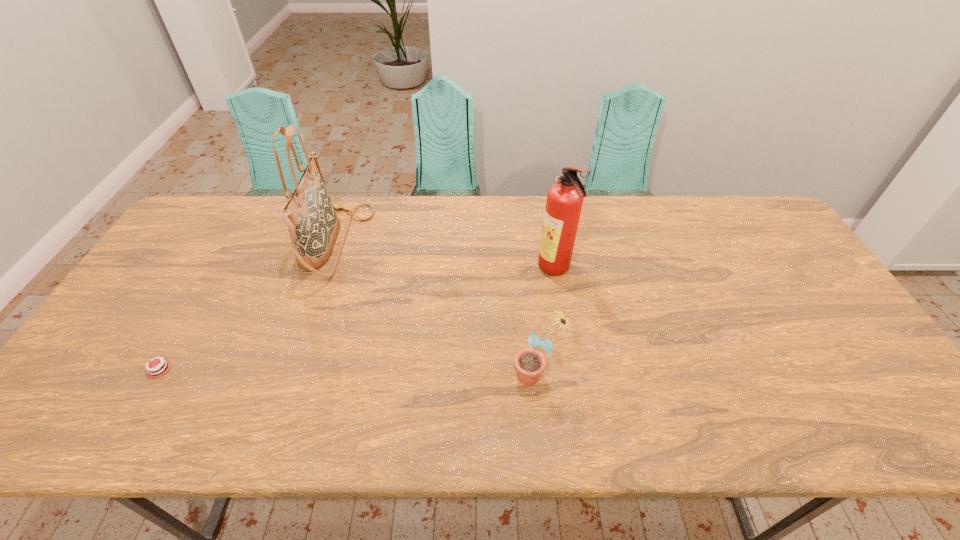
Where is `vacant region between the fire extinguisher and the handbag`? The image size is (960, 540). vacant region between the fire extinguisher and the handbag is located at coordinates (445, 256).

Image resolution: width=960 pixels, height=540 pixels. In order to click on blank region between the leftmost object and the handbag in this screenshot , I will do `click(247, 306)`.

Locate an element on the screen. vacant area that lies between the handbag and the third tallest object is located at coordinates (436, 309).

Where is `vacant space in between the shortest object and the handbag`? The width and height of the screenshot is (960, 540). vacant space in between the shortest object and the handbag is located at coordinates (247, 306).

At what (x,y) coordinates should I click in order to perform the action: click on vacant area between the chocolate cake and the fire extinguisher. Please return your answer as a coordinate pair (x, y). The height and width of the screenshot is (540, 960). Looking at the image, I should click on (357, 319).

Image resolution: width=960 pixels, height=540 pixels. In order to click on free point between the fire extinguisher and the third tallest object in this screenshot , I will do `click(546, 323)`.

You are a GUI agent. You are given a task and a screenshot of the screen. Output one action in this format:
    pyautogui.click(x=<x>, y=<y>)
    Task: Click on the unoccupied area between the fire extinguisher and the sunflower
    This screenshot has height=540, width=960.
    Given the screenshot: What is the action you would take?
    pyautogui.click(x=546, y=323)

This screenshot has width=960, height=540. I want to click on free space between the leftmost object and the fire extinguisher, so click(x=357, y=319).

Identify the location of free spot between the third object from right to left and the shortest object. Image resolution: width=960 pixels, height=540 pixels. pyautogui.click(x=247, y=306).

Where is `vacant area that lies between the fire extinguisher and the second shortest object`? This screenshot has width=960, height=540. vacant area that lies between the fire extinguisher and the second shortest object is located at coordinates (546, 323).